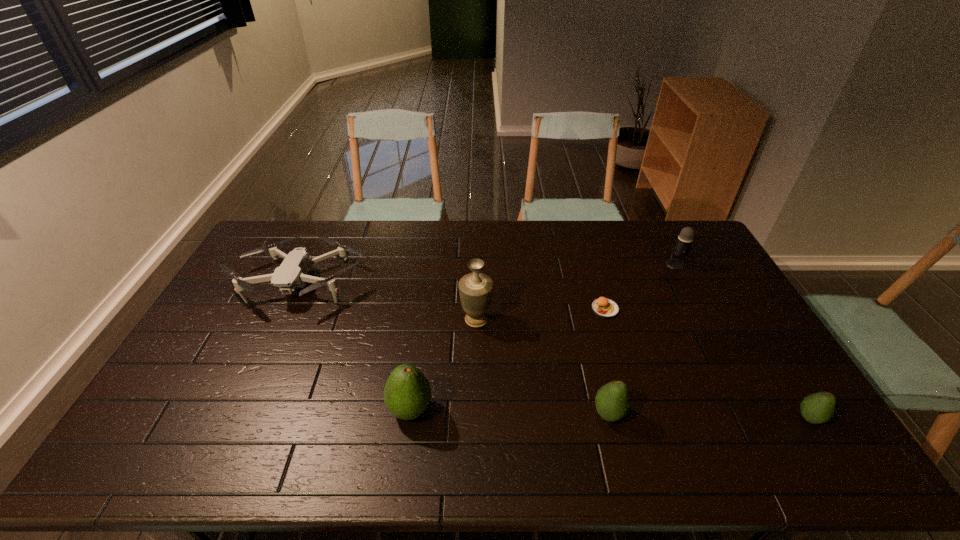
The height and width of the screenshot is (540, 960). What are the coordinates of `microphone at the right edge` in the screenshot? It's located at (683, 245).

Identify the location of object that is at the far left corner. (292, 273).

This screenshot has height=540, width=960. In order to click on object at the near right corner in this screenshot , I will do `click(817, 408)`.

I want to click on vacant area at the far edge of the desktop, so click(x=365, y=222).

In the image, there is a desktop. At what (x,y) coordinates should I click in order to perform the action: click on vacant area at the near edge. Please return your answer as a coordinate pair (x, y). This screenshot has width=960, height=540. Looking at the image, I should click on (685, 409).

This screenshot has width=960, height=540. In order to click on free space at the left edge of the desktop in this screenshot , I will do `click(236, 299)`.

The height and width of the screenshot is (540, 960). In the image, there is a desktop. What are the coordinates of `free space at the far left corner` in the screenshot? It's located at (283, 224).

The width and height of the screenshot is (960, 540). I want to click on free spot at the far right corner of the desktop, so click(673, 223).

Image resolution: width=960 pixels, height=540 pixels. I want to click on unoccupied position between the urn and the second avocado from right to left, so click(x=542, y=367).

In order to click on vacant area that lies between the drone and the second shortest avocado in this screenshot , I will do `click(454, 348)`.